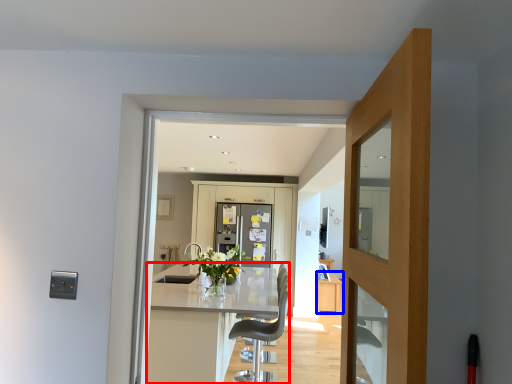
Question: Which of the following is the closest to the observer, kitchen & dining room table (highlighted by a red box) or cabinetry (highlighted by a blue box)?

Choices:
 (A) kitchen & dining room table
 (B) cabinetry

Answer: (A)